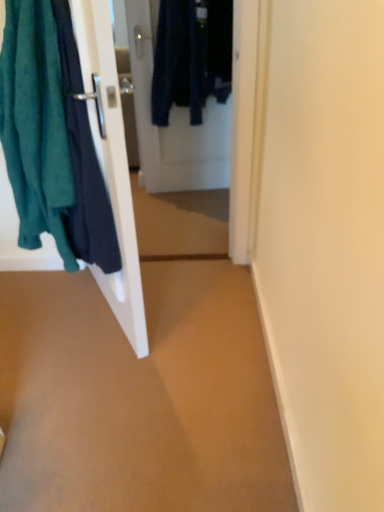
What do you see at coordinates (139, 396) in the screenshot? The height and width of the screenshot is (512, 384). I see `brown matte carpet at center` at bounding box center [139, 396].

Measure the distance between white glossy door at left, positioned as the second door in back-to-front order, and camera.

white glossy door at left, positioned as the second door in back-to-front order, and camera are 3.42 feet apart from each other.

Locate an element on the screen. brown matte carpet at center is located at coordinates (139, 396).

Which of these two, teal fabric towel at left or brown matte carpet at center, is bigger?

teal fabric towel at left.

From the image's perspective, is teal fabric towel at left over brown matte carpet at center?

Indeed, from the image's perspective, teal fabric towel at left is shown above brown matte carpet at center.

Is teal fabric towel at left looking in the opposite direction of brown matte carpet at center?

No, brown matte carpet at center is not at the back of teal fabric towel at left.

Is teal fabric towel at left taller or shorter than brown matte carpet at center?

Clearly, teal fabric towel at left is taller compared to brown matte carpet at center.

Is teal fabric towel at left in contact with white glossy door at center, acting as the 1th door starting from the back?

teal fabric towel at left is not next to white glossy door at center, acting as the 1th door starting from the back, and they're not touching.

How different are the orientations of teal fabric towel at left and white glossy door at center, positioned as the second door in front-to-back order, in degrees?

There is a 75-degree angle between the facing directions of teal fabric towel at left and white glossy door at center, positioned as the second door in front-to-back order.

From a real-world perspective, is teal fabric towel at left positioned above or below white glossy door at center, acting as the 1th door starting from the back?

Clearly, from a real-world perspective, teal fabric towel at left is above white glossy door at center, acting as the 1th door starting from the back.

Which of these two, teal fabric towel at left or white glossy door at center, acting as the 1th door starting from the back, is thinner?

Thinner between the two is white glossy door at center, acting as the 1th door starting from the back.

Would you say brown matte carpet at center contains white glossy door at center, positioned as the second door in front-to-back order?

No.

Based on the photo, relative to white glossy door at center, positioned as the second door in front-to-back order, is brown matte carpet at center in front or behind?

In the image, brown matte carpet at center appears in front of white glossy door at center, positioned as the second door in front-to-back order.

Is brown matte carpet at center next to white glossy door at center, acting as the 1th door starting from the back, and touching it?

No, brown matte carpet at center is not with white glossy door at center, acting as the 1th door starting from the back.

Does white glossy door at center, positioned as the second door in front-to-back order, have a lesser height compared to white glossy door at left, the 1th door in the front-to-back sequence?

Indeed, white glossy door at center, positioned as the second door in front-to-back order, has a lesser height compared to white glossy door at left, the 1th door in the front-to-back sequence.

Consider the image. From the image's perspective, relative to white glossy door at left, the 1th door in the front-to-back sequence, is white glossy door at center, positioned as the second door in front-to-back order, above or below?

Based on their image positions, white glossy door at center, positioned as the second door in front-to-back order, is located above white glossy door at left, the 1th door in the front-to-back sequence.

Does teal fabric towel at left turn towards white glossy door at left, positioned as the second door in back-to-front order?

No, teal fabric towel at left is not oriented towards white glossy door at left, positioned as the second door in back-to-front order.

Does teal fabric towel at left have a lesser width compared to white glossy door at left, the 1th door in the front-to-back sequence?

No.

Is teal fabric towel at left touching white glossy door at left, the 1th door in the front-to-back sequence?

No.

Does teal fabric towel at left have a lesser height compared to white glossy door at left, positioned as the second door in back-to-front order?

Correct, teal fabric towel at left is not as tall as white glossy door at left, positioned as the second door in back-to-front order.

Choose the correct answer: Is white glossy door at center, positioned as the second door in front-to-back order, inside teal fabric towel at left or outside it?

white glossy door at center, positioned as the second door in front-to-back order, is located beyond the bounds of teal fabric towel at left.

Considering the positions of objects white glossy door at center, acting as the 1th door starting from the back, and teal fabric towel at left in the image provided, who is in front, white glossy door at center, acting as the 1th door starting from the back, or teal fabric towel at left?

teal fabric towel at left is closer to the camera.

Can you tell me how much white glossy door at center, acting as the 1th door starting from the back, and teal fabric towel at left differ in facing direction?

There is a 75-degree angle between the facing directions of white glossy door at center, acting as the 1th door starting from the back, and teal fabric towel at left.

Is there a large distance between brown matte carpet at center and white glossy door at left, positioned as the second door in back-to-front order?

They are positioned close to each other.

Can you confirm if brown matte carpet at center is thinner than white glossy door at left, positioned as the second door in back-to-front order?

Incorrect, the width of brown matte carpet at center is not less than that of white glossy door at left, positioned as the second door in back-to-front order.

From the image's perspective, is brown matte carpet at center positioned above or below white glossy door at left, the 1th door in the front-to-back sequence?

brown matte carpet at center is below white glossy door at left, the 1th door in the front-to-back sequence.

Would you say white glossy door at left, positioned as the second door in back-to-front order, is part of brown matte carpet at center's contents?

No, white glossy door at left, positioned as the second door in back-to-front order, is not surrounded by brown matte carpet at center.

Identify the location of towel on the left of the brown matte carpet at center. (35, 125).

The height and width of the screenshot is (512, 384). I want to click on towel located below the white glossy door at center, positioned as the second door in front-to-back order (from the image's perspective), so click(35, 125).

Consider the image. When comparing their distances from brown matte carpet at center, does teal fabric towel at left or white glossy door at left, the 1th door in the front-to-back sequence, seem closer?

white glossy door at left, the 1th door in the front-to-back sequence, is closer to brown matte carpet at center.

Considering their positions, is teal fabric towel at left positioned closer to white glossy door at center, positioned as the second door in front-to-back order, than brown matte carpet at center?

teal fabric towel at left lies closer to white glossy door at center, positioned as the second door in front-to-back order, than the other object.

Estimate the real-world distances between objects in this image. Which object is further from teal fabric towel at left, brown matte carpet at center or white glossy door at center, positioned as the second door in front-to-back order?

white glossy door at center, positioned as the second door in front-to-back order.

When comparing their distances from white glossy door at left, positioned as the second door in back-to-front order, does brown matte carpet at center or white glossy door at center, positioned as the second door in front-to-back order, seem further?

Based on the image, white glossy door at center, positioned as the second door in front-to-back order, appears to be further to white glossy door at left, positioned as the second door in back-to-front order.

When comparing their distances from brown matte carpet at center, does white glossy door at left, the 1th door in the front-to-back sequence, or white glossy door at center, acting as the 1th door starting from the back, seem closer?

white glossy door at left, the 1th door in the front-to-back sequence, is positioned closer to the anchor brown matte carpet at center.

From the image, which object appears to be nearer to brown matte carpet at center, white glossy door at center, positioned as the second door in front-to-back order, or white glossy door at left, the 1th door in the front-to-back sequence?

white glossy door at left, the 1th door in the front-to-back sequence.

Estimate the real-world distances between objects in this image. Which object is closer to brown matte carpet at center, white glossy door at center, positioned as the second door in front-to-back order, or teal fabric towel at left?

teal fabric towel at left is positioned closer to the anchor brown matte carpet at center.

Which object lies further to the anchor point teal fabric towel at left, white glossy door at center, acting as the 1th door starting from the back, or brown matte carpet at center?

white glossy door at center, acting as the 1th door starting from the back, is further to teal fabric towel at left.

Identify the location of door between teal fabric towel at left and white glossy door at center, acting as the 1th door starting from the back, from front to back. (111, 164).

You are a GUI agent. You are given a task and a screenshot of the screen. Output one action in this format:
    pyautogui.click(x=<x>, y=<y>)
    Task: Click on the door between teal fabric towel at left and brown matte carpet at center vertically
    
    Given the screenshot: What is the action you would take?
    pyautogui.click(x=111, y=164)

Where is `plain located between white glossy door at left, the 1th door in the front-to-back sequence, and white glossy door at center, acting as the 1th door starting from the back, in the depth direction`? plain located between white glossy door at left, the 1th door in the front-to-back sequence, and white glossy door at center, acting as the 1th door starting from the back, in the depth direction is located at coordinates (139, 396).

Identify the location of plain between teal fabric towel at left and white glossy door at center, positioned as the second door in front-to-back order, in the front-back direction. pos(139,396).